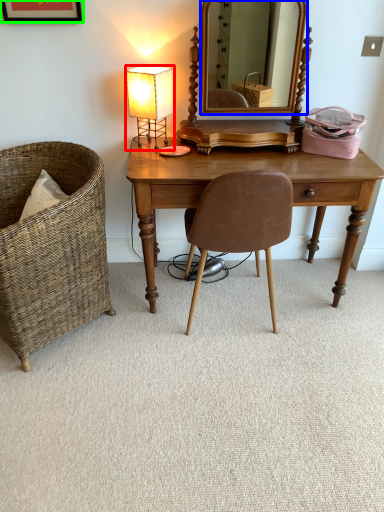
Question: Which is nearer to the lamp (highlighted by a red box)? mirror (highlighted by a blue box) or picture frame (highlighted by a green box).

Choices:
 (A) mirror
 (B) picture frame

Answer: (B)